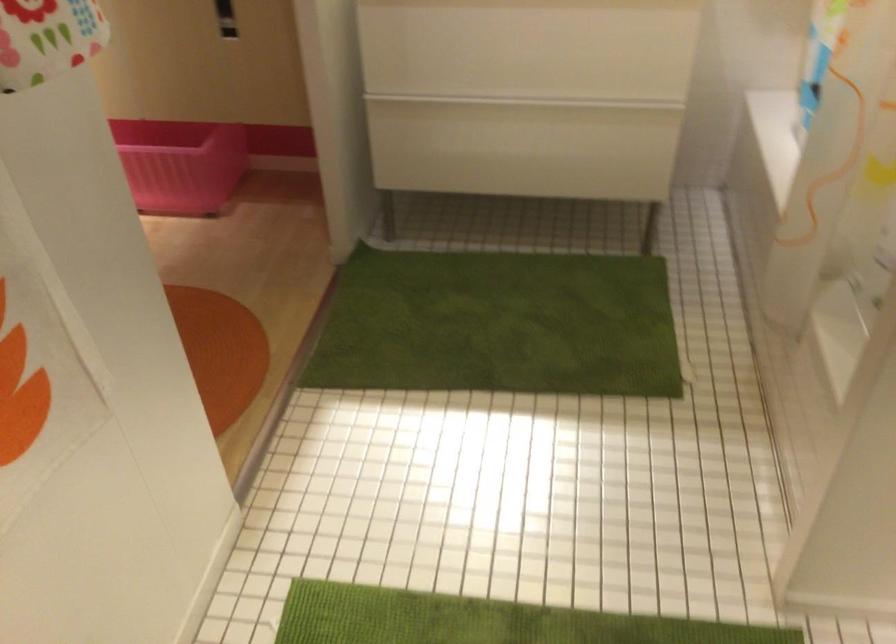
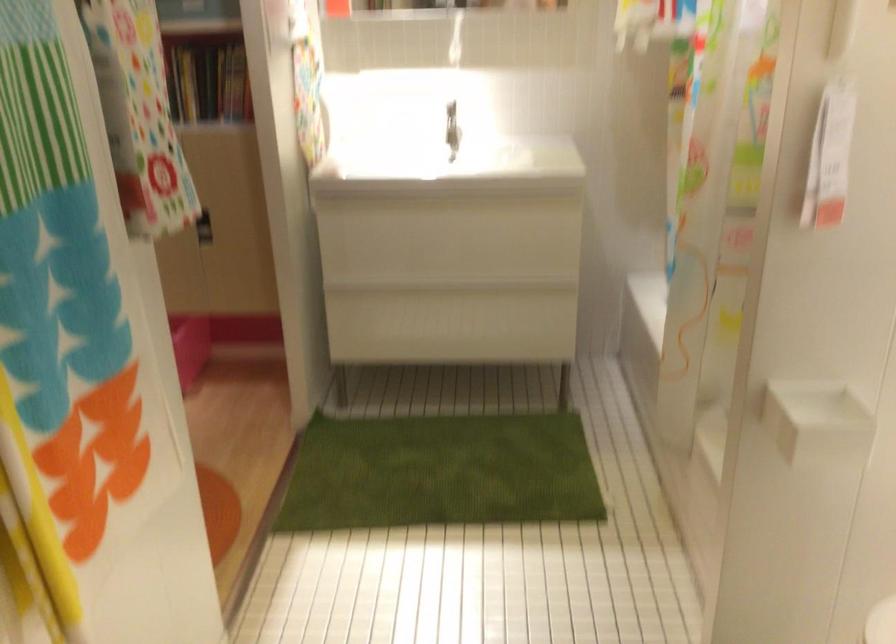
Locate, in the second image, the point that corresponds to the point at 521,100 in the first image.

(453, 288)